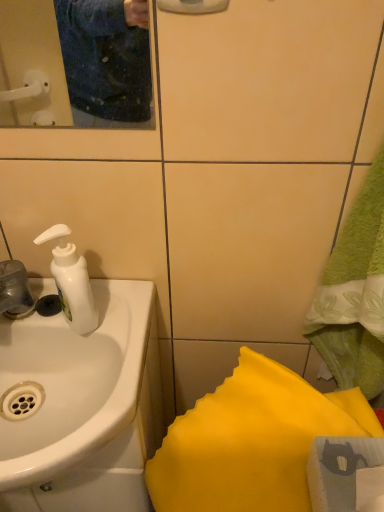
Question: Is yellow fabric at lower right next to white glossy sink at left?

Choices:
 (A) no
 (B) yes

Answer: (A)

Question: Is yellow fabric at lower right wider than white glossy sink at left?

Choices:
 (A) yes
 (B) no

Answer: (B)

Question: From a real-world perspective, is yellow fabric at lower right physically above white glossy sink at left?

Choices:
 (A) no
 (B) yes

Answer: (A)

Question: Is yellow fabric at lower right taller than white glossy sink at left?

Choices:
 (A) yes
 (B) no

Answer: (A)

Question: Can you confirm if yellow fabric at lower right is thinner than white glossy sink at left?

Choices:
 (A) no
 (B) yes

Answer: (B)

Question: Looking at their shapes, would you say white glossy sink at left is wider or thinner than matte plastic mirror at upper left?

Choices:
 (A) thin
 (B) wide

Answer: (B)

Question: Looking at the image, does white glossy sink at left seem bigger or smaller compared to matte plastic mirror at upper left?

Choices:
 (A) small
 (B) big

Answer: (B)

Question: Based on their positions, is white glossy sink at left located to the left or right of matte plastic mirror at upper left?

Choices:
 (A) right
 (B) left

Answer: (A)

Question: Is white glossy sink at left spatially inside matte plastic mirror at upper left, or outside of it?

Choices:
 (A) inside
 (B) outside

Answer: (B)

Question: Is yellow fabric at lower right wider or thinner than white glossy sink at left?

Choices:
 (A) thin
 (B) wide

Answer: (A)

Question: Based on their sizes in the image, would you say yellow fabric at lower right is bigger or smaller than white glossy sink at left?

Choices:
 (A) small
 (B) big

Answer: (A)

Question: From the image's perspective, relative to white glossy sink at left, is yellow fabric at lower right above or below?

Choices:
 (A) above
 (B) below

Answer: (B)

Question: Considering the positions of yellow fabric at lower right and white glossy sink at left in the image, is yellow fabric at lower right taller or shorter than white glossy sink at left?

Choices:
 (A) tall
 (B) short

Answer: (A)

Question: Looking at their shapes, would you say matte plastic mirror at upper left is wider or thinner than white glossy sink at left?

Choices:
 (A) wide
 (B) thin

Answer: (B)

Question: Considering the positions of point (105, 23) and point (1, 328), is point (105, 23) closer or farther from the camera than point (1, 328)?

Choices:
 (A) closer
 (B) farther

Answer: (B)